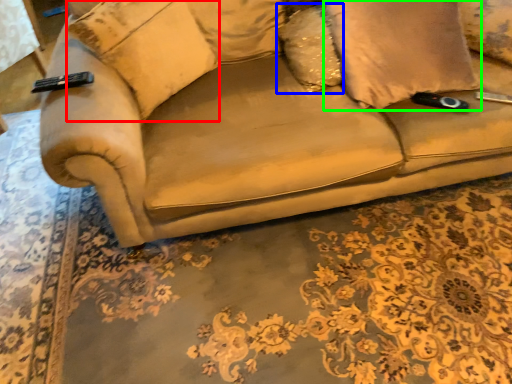
Question: Which object is the farthest from pillow (highlighted by a red box)? Choose among these: pillow (highlighted by a blue box) or pillow (highlighted by a green box).

Choices:
 (A) pillow
 (B) pillow

Answer: (B)